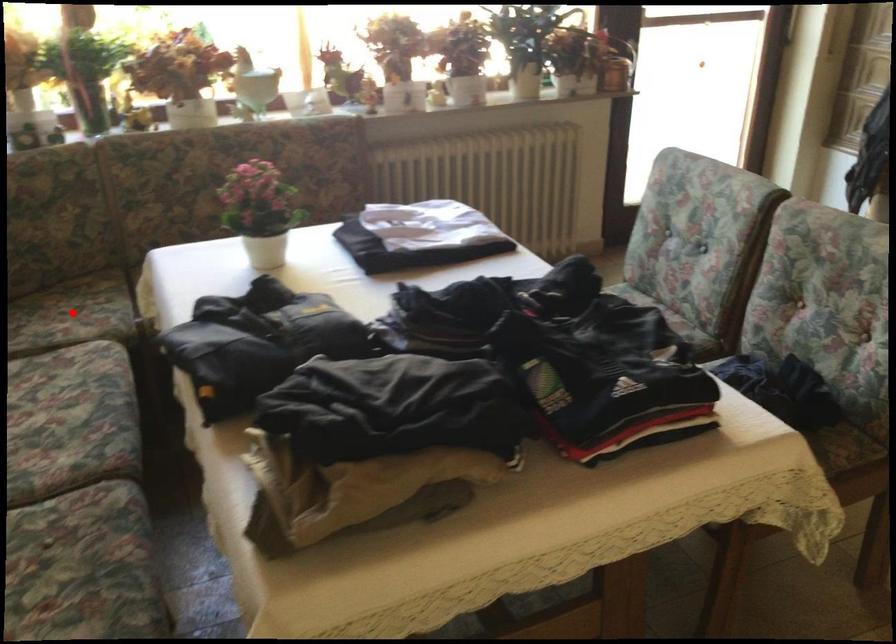
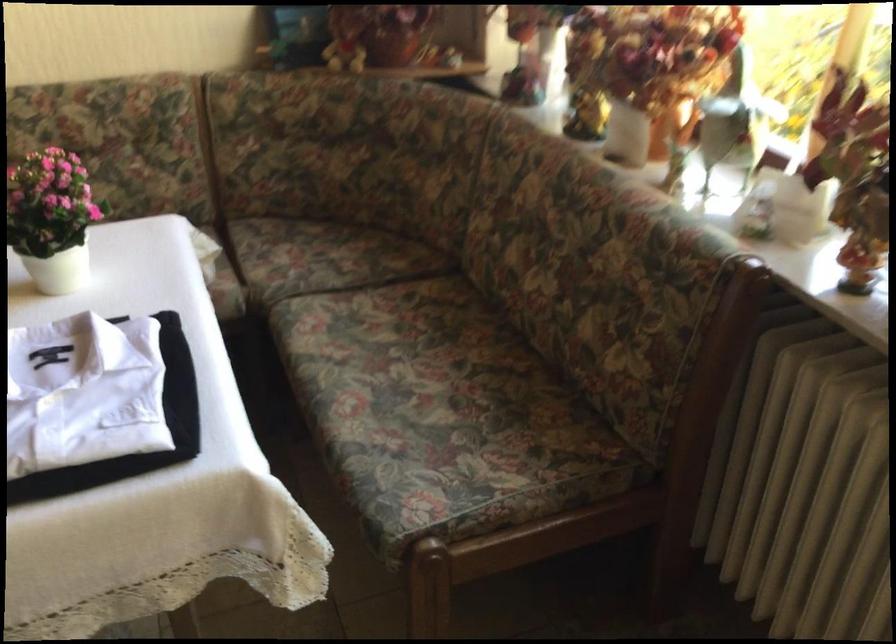
Question: A red point is marked in image1. In image2, is the corresponding 3D point closer to the camera or farther? Reply with the corresponding letter.

Choices:
 (A) The corresponding 3D point is closer.
 (B) The corresponding 3D point is farther.

Answer: (A)